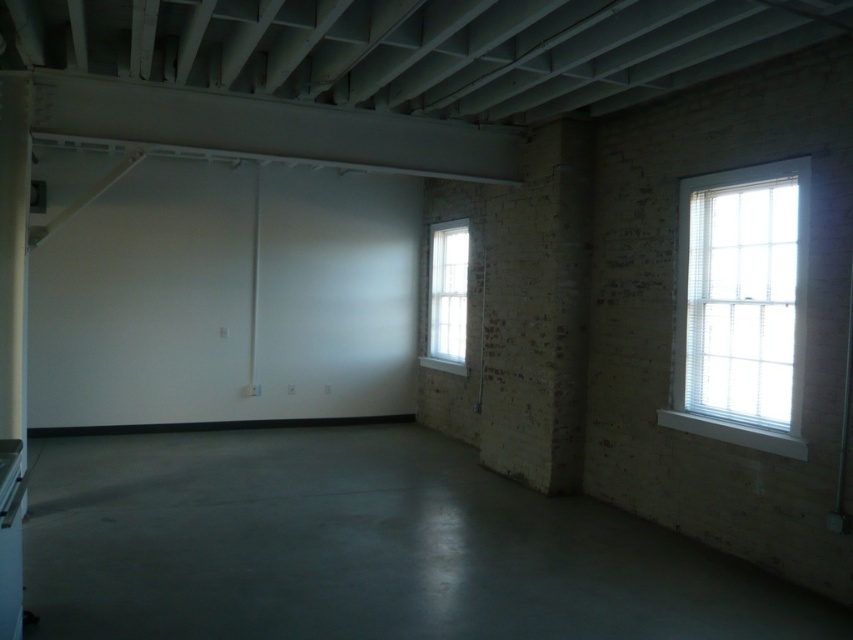
Looking at this image, between white wooden window at upper right and white glass window at center, which one appears on the left side from the viewer's perspective?

white glass window at center

Is point (695, 289) closer to camera compared to point (453, 298)?

Yes, point (695, 289) is closer to viewer.

Identify the location of white wooden window at upper right. This screenshot has width=853, height=640. [x=741, y=307].